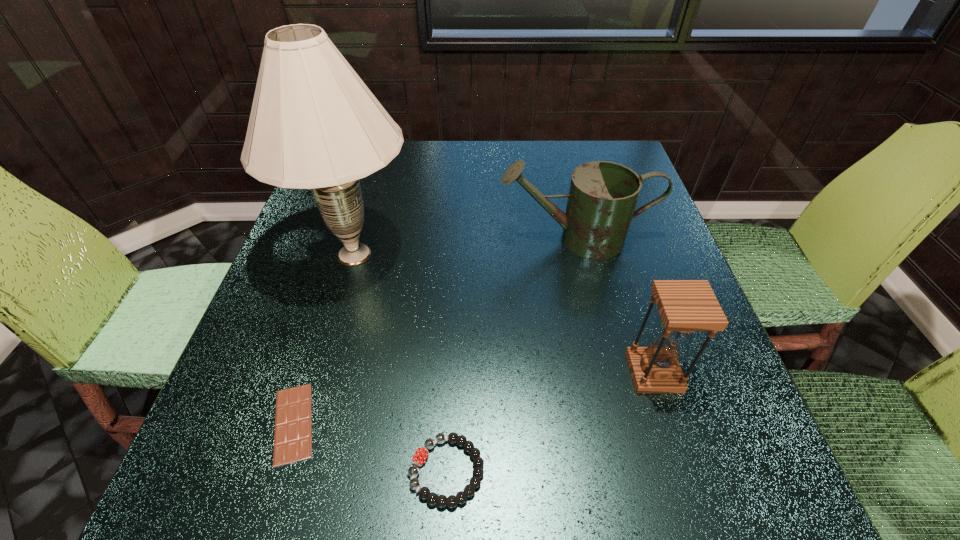
I want to click on free space between the tallest object and the chocolate bar, so click(x=324, y=339).

Identify the location of free space between the third object from left to right and the lampshade. This screenshot has width=960, height=540. (400, 362).

Identify the location of vacant area that lies between the tallest object and the bracelet. tap(400, 362).

Locate an element on the screen. Image resolution: width=960 pixels, height=540 pixels. vacant area that lies between the third object from right to left and the tallest object is located at coordinates (400, 362).

You are a GUI agent. You are given a task and a screenshot of the screen. Output one action in this format:
    pyautogui.click(x=<x>, y=<y>)
    Task: Click on the free space between the fourth tallest object and the lampshade
    The width and height of the screenshot is (960, 540).
    Given the screenshot: What is the action you would take?
    pyautogui.click(x=400, y=362)

You are a GUI agent. You are given a task and a screenshot of the screen. Output one action in this format:
    pyautogui.click(x=<x>, y=<y>)
    Task: Click on the object that ranks as the closest to the second shortest object
    Image resolution: width=960 pixels, height=540 pixels.
    Given the screenshot: What is the action you would take?
    pyautogui.click(x=293, y=421)

Identify which object is the fourth nearest to the watering can. Please provide its 2D coordinates. Your answer should be formatted as a tuple, i.e. [(x, y)], where the tuple contains the x and y coordinates of a point satisfying the conditions above.

[(293, 421)]

Where is `blank area in the image that satisfies the following two spatial constraints: 1. on the back side of the hourglass; 2. on the right side of the bracelet`? blank area in the image that satisfies the following two spatial constraints: 1. on the back side of the hourglass; 2. on the right side of the bracelet is located at coordinates (451, 373).

Where is `free space in the image that satisfies the following two spatial constraints: 1. on the front side of the lampshade; 2. on the left side of the third object from left to right`? The image size is (960, 540). free space in the image that satisfies the following two spatial constraints: 1. on the front side of the lampshade; 2. on the left side of the third object from left to right is located at coordinates (292, 471).

This screenshot has height=540, width=960. I want to click on free space that satisfies the following two spatial constraints: 1. on the back side of the bracelet; 2. on the right side of the hourglass, so click(451, 373).